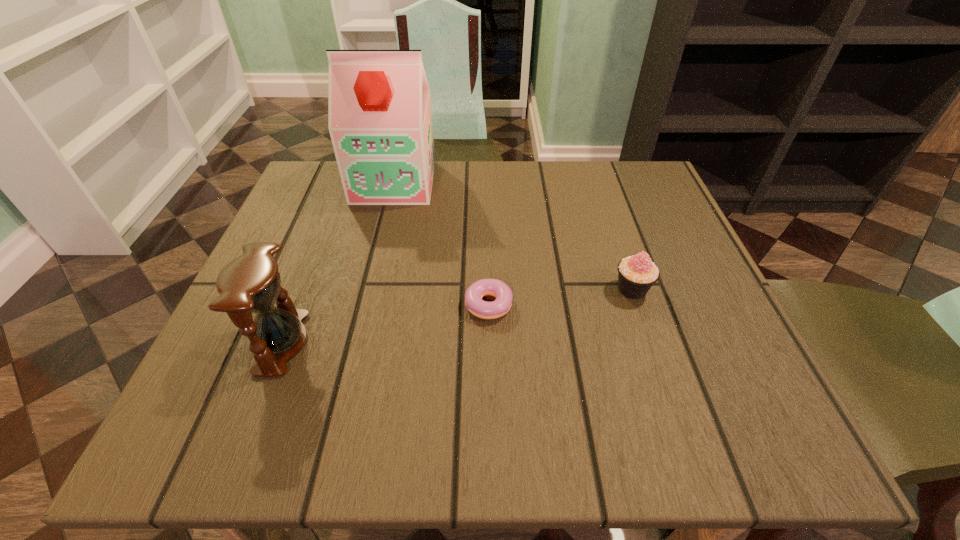
Where is `free location that satisfies the following two spatial constraints: 1. with the cap open on the rightmost object; 2. on the right side of the soya milk`? Image resolution: width=960 pixels, height=540 pixels. free location that satisfies the following two spatial constraints: 1. with the cap open on the rightmost object; 2. on the right side of the soya milk is located at coordinates (368, 289).